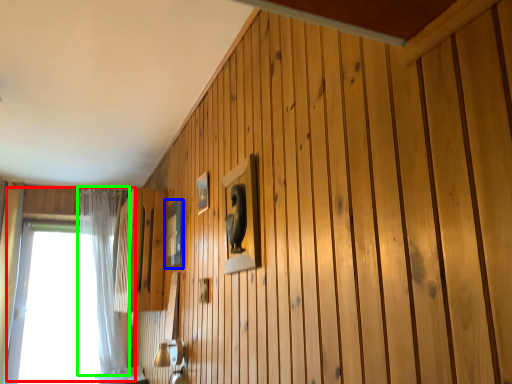
Question: Estimate the real-world distances between objects in this image. Which object is closer to window (highlighted by a red box), picture frame (highlighted by a blue box) or curtain (highlighted by a green box)?

Choices:
 (A) picture frame
 (B) curtain

Answer: (B)